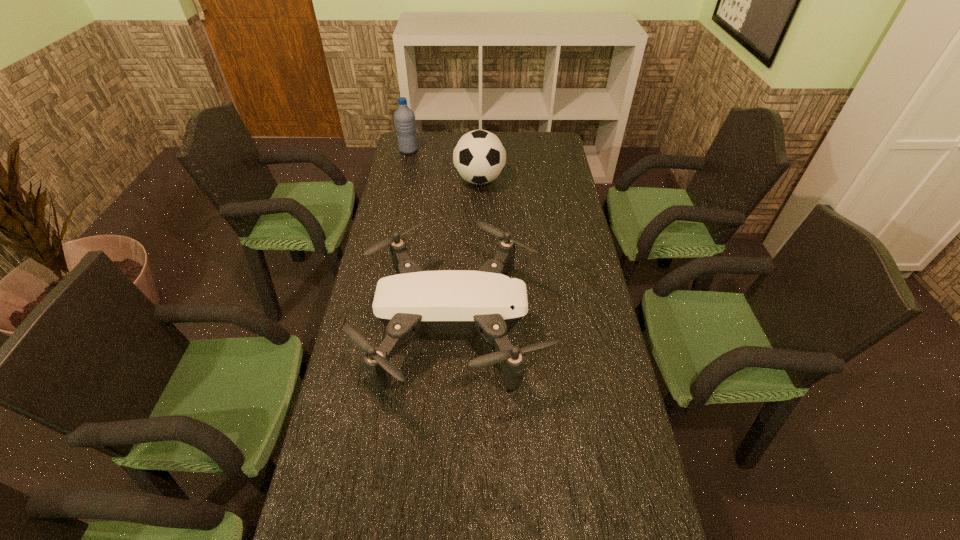
Locate an element on the screen. The image size is (960, 540). object positioned at the far left corner is located at coordinates (404, 117).

In the image, there is a desktop. At what (x,y) coordinates should I click in order to perform the action: click on vacant region at the far edge. Please return your answer as a coordinate pair (x, y). Looking at the image, I should click on (504, 138).

Find the location of a particular element. vacant space at the left edge of the desktop is located at coordinates (369, 389).

Where is `vacant space at the right edge of the desktop`? This screenshot has height=540, width=960. vacant space at the right edge of the desktop is located at coordinates (606, 333).

In the image, there is a desktop. At what (x,y) coordinates should I click in order to perform the action: click on vacant space at the far left corner. Please return your answer as a coordinate pair (x, y). Looking at the image, I should click on (434, 138).

The image size is (960, 540). What are the coordinates of `free point between the drone and the farthest object` in the screenshot? It's located at (432, 238).

Image resolution: width=960 pixels, height=540 pixels. Identify the location of free space between the farthest object and the second farthest object. (444, 165).

I want to click on vacant space that's between the nearest object and the farthest object, so pyautogui.click(x=432, y=238).

Image resolution: width=960 pixels, height=540 pixels. I want to click on free space between the drone and the farthest object, so (432, 238).

You are a GUI agent. You are given a task and a screenshot of the screen. Output one action in this format:
    pyautogui.click(x=<x>, y=<y>)
    Task: Click on the vacant area between the second nearest object and the drone
    
    Given the screenshot: What is the action you would take?
    pyautogui.click(x=468, y=253)